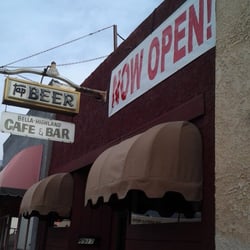
Where is `poster`? Image resolution: width=250 pixels, height=250 pixels. poster is located at coordinates (145, 86).